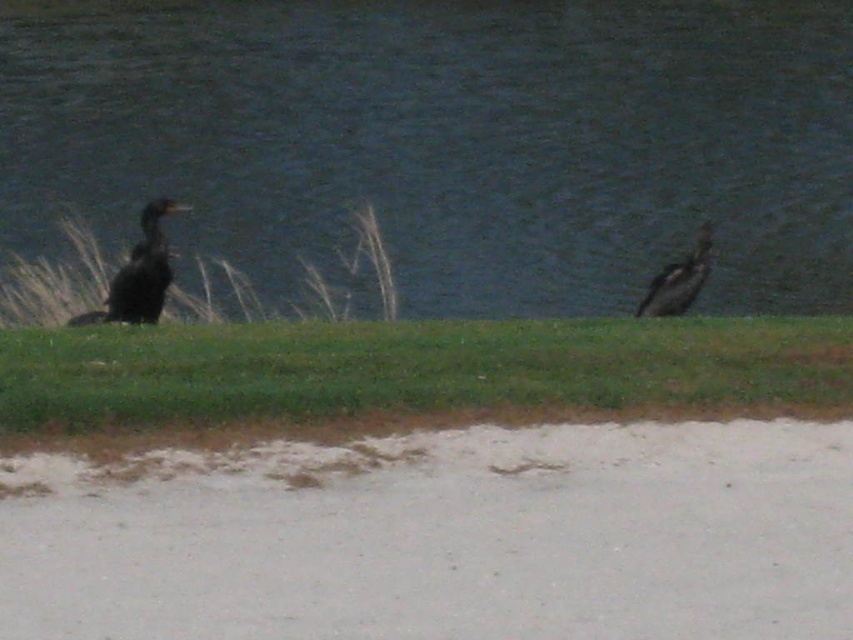
Which is below, green grass at center or dark brown feathers at right?

green grass at center is below.

In the scene shown: Is green grass at center behind dark brown feathers at right?

No, it is not.

The image size is (853, 640). Identify the location of green grass at center. (412, 369).

The image size is (853, 640). Find the location of `green grass at center`. green grass at center is located at coordinates (412, 369).

This screenshot has width=853, height=640. In order to click on dark blue water at center in this screenshot , I will do `click(448, 140)`.

In the scene shown: Between dark blue water at center and dark brown feathers at right, which one appears on the left side from the viewer's perspective?

Positioned to the left is dark brown feathers at right.

Which is in front, point (804, 44) or point (672, 262)?

Point (672, 262) is in front.

Find the location of a particular element. dark blue water at center is located at coordinates coord(448,140).

Is point (785, 112) more distant than point (167, 252)?

Yes, point (785, 112) is behind point (167, 252).

How much distance is there between dark blue water at center and dark brown feathers at left?

dark blue water at center and dark brown feathers at left are 21.95 meters apart.

Image resolution: width=853 pixels, height=640 pixels. Identify the location of dark blue water at center. (448, 140).

Image resolution: width=853 pixels, height=640 pixels. Identify the location of dark blue water at center. (448, 140).